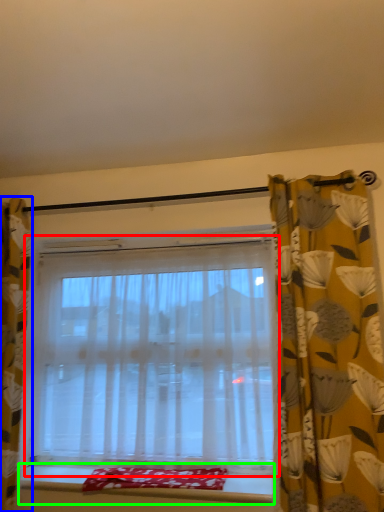
Question: Estimate the real-world distances between objects in this image. Which object is farther from window (highlighted by a red box), curtain (highlighted by a blue box) or window sill (highlighted by a green box)?

Choices:
 (A) curtain
 (B) window sill

Answer: (A)